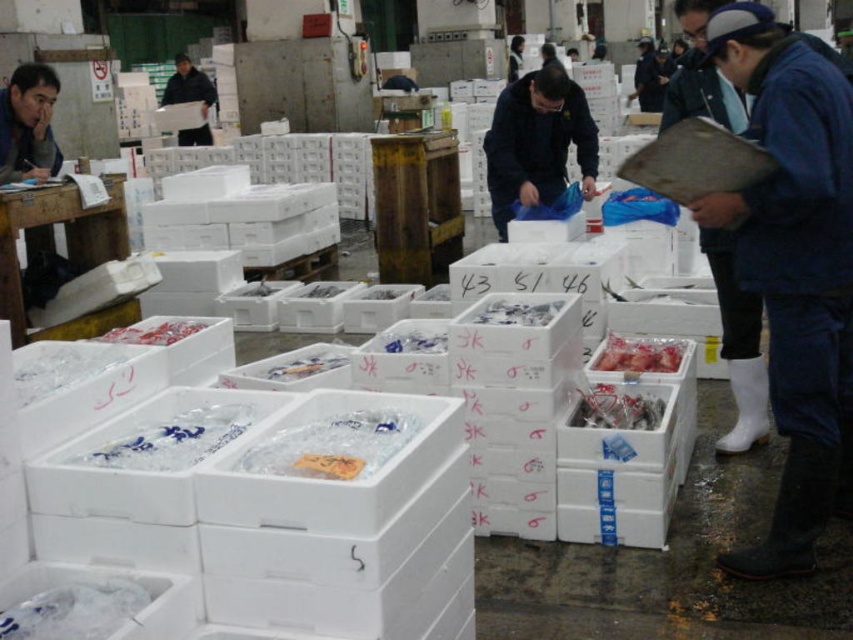
You are a customer at the fish market and want to approach both the blue denim jacket at upper right and the dark blue jacket at center. Which jacket is closer to you?

The dark blue jacket at center is closer to you because the blue denim jacket at upper right is taller, which usually indicates it is further away in the image.

You are standing in the fish market and want to take a photo of the two points mentioned. Which point, point (788, 180) or point (193, 77), will appear larger in your camera view?

Point (788, 180) will appear larger in the camera view because it is closer to the camera than point (193, 77).

You are a customer trying to find a vendor in this fish market. You notice two jackets hanging on a nearby rack. The jackets are the blue denim jacket at upper right and the black matte jacket at upper left. Which jacket is more likely to belong to a vendor who works in this market?

The blue denim jacket at upper right is more likely to belong to a vendor who works in this market because it is thinner than the black matte jacket at upper left, suggesting it is more practical for working in a busy environment.